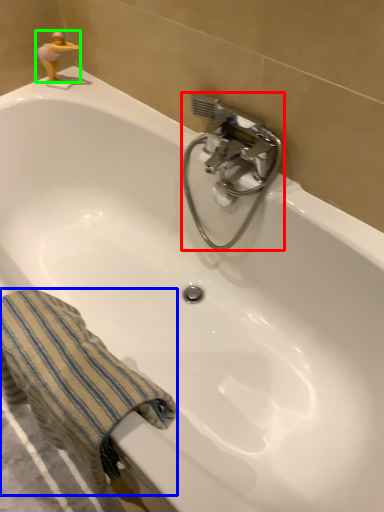
Question: Estimate the real-world distances between objects in this image. Which object is closer to plumbing fixture (highlighted by a red box), towel/napkin (highlighted by a blue box) or miniature (highlighted by a green box)?

Choices:
 (A) towel/napkin
 (B) miniature

Answer: (A)